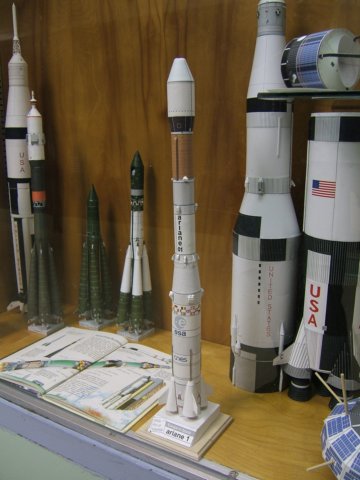
Identify the location of wood finish. (288, 441), (213, 314).